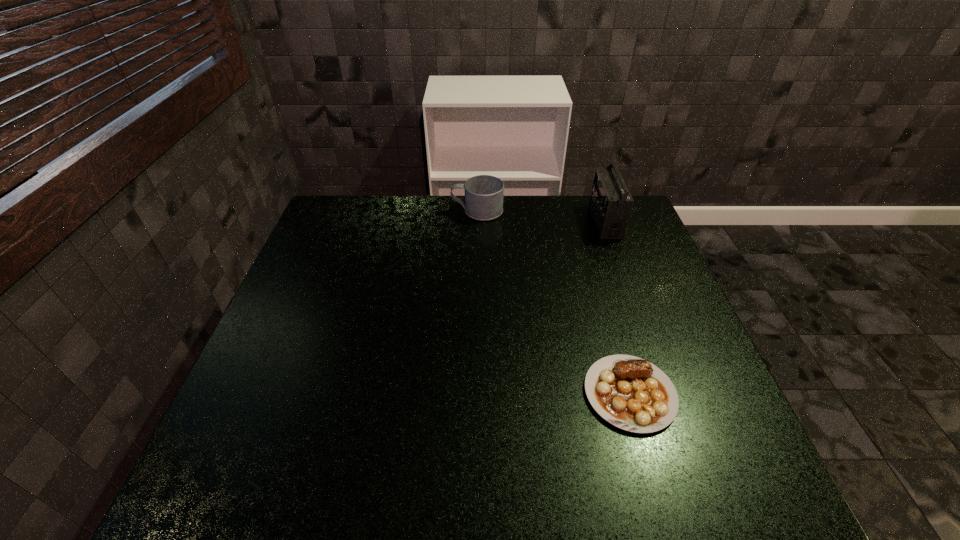
The image size is (960, 540). I want to click on free space located 0.180m on the side of the second tallest object with the handle, so click(x=397, y=211).

The width and height of the screenshot is (960, 540). In order to click on vacant space located 0.120m on the left of the shortest object in this screenshot , I will do 529,394.

The height and width of the screenshot is (540, 960). In order to click on radio receiver at the far edge in this screenshot , I will do `click(611, 203)`.

Locate an element on the screen. The image size is (960, 540). mug at the far edge is located at coordinates (483, 194).

Identify the location of radio receiver positioned at the right edge. The height and width of the screenshot is (540, 960). (611, 203).

In order to click on steak at the right edge in this screenshot , I will do `click(631, 393)`.

Find the location of `object located at the far right corner`. object located at the far right corner is located at coordinates (611, 203).

Locate an element on the screen. The height and width of the screenshot is (540, 960). vacant space at the far edge of the desktop is located at coordinates point(407,230).

The height and width of the screenshot is (540, 960). Find the location of `free space at the near edge`. free space at the near edge is located at coordinates (426, 492).

This screenshot has width=960, height=540. Find the location of `vacant space at the left edge of the desktop`. vacant space at the left edge of the desktop is located at coordinates (339, 317).